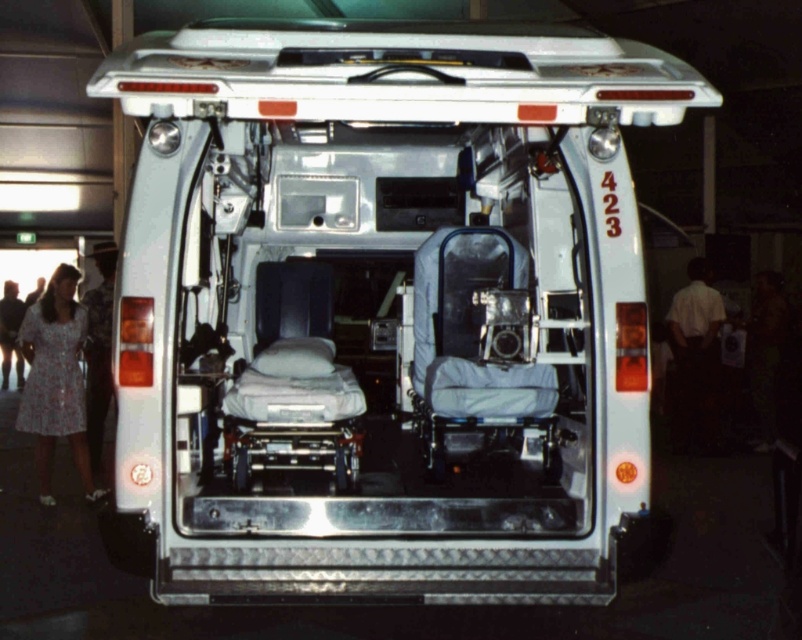
Between floral dress at left and patterned fabric dress at left, which one has more height?

Standing taller between the two is patterned fabric dress at left.

Which is more to the left, floral dress at left or patterned fabric dress at left?

floral dress at left

Does point (45, 388) lie behind point (107, 250)?

No, (45, 388) is in front of (107, 250).

The width and height of the screenshot is (802, 640). I want to click on floral dress at left, so 55,380.

Does matte gray ambulance at center have a lesser width compared to white shirt at right?

No, matte gray ambulance at center is not thinner than white shirt at right.

Is matte gray ambulance at center wider than white shirt at right?

Yes.

Does point (581, 364) lie in front of point (681, 289)?

Yes, it is in front of point (681, 289).

Find the location of a particular element. This screenshot has width=802, height=640. matte gray ambulance at center is located at coordinates (385, 308).

Based on the photo, who is lower down, patterned fabric dress at left or light blue dress at lower left?

light blue dress at lower left is lower down.

Can you confirm if patterned fabric dress at left is taller than light blue dress at lower left?

Correct, patterned fabric dress at left is much taller as light blue dress at lower left.

You are a GUI agent. You are given a task and a screenshot of the screen. Output one action in this format:
    pyautogui.click(x=<x>, y=<y>)
    Task: Click on the patterned fabric dress at left
    
    Given the screenshot: What is the action you would take?
    pyautogui.click(x=98, y=349)